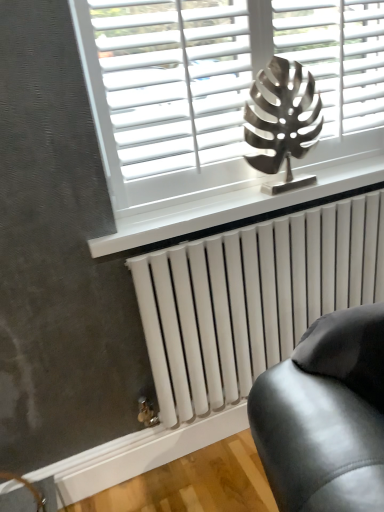
Question: Is white glossy radiator at lower center a part of metallic leaf at center?

Choices:
 (A) no
 (B) yes

Answer: (A)

Question: Is metallic leaf at center shorter than white glossy radiator at lower center?

Choices:
 (A) yes
 (B) no

Answer: (B)

Question: Considering the relative positions of metallic leaf at center and white glossy radiator at lower center in the image provided, is metallic leaf at center behind white glossy radiator at lower center?

Choices:
 (A) yes
 (B) no

Answer: (B)

Question: Is metallic leaf at center facing away from white glossy radiator at lower center?

Choices:
 (A) yes
 (B) no

Answer: (B)

Question: From a real-world perspective, does metallic leaf at center sit lower than white glossy radiator at lower center?

Choices:
 (A) yes
 (B) no

Answer: (B)

Question: Does point (170, 20) appear closer or farther from the camera than point (132, 239)?

Choices:
 (A) closer
 (B) farther

Answer: (A)

Question: Is white matte blinds at upper center bigger or smaller than white glossy radiator at lower center?

Choices:
 (A) big
 (B) small

Answer: (A)

Question: Visually, is white matte blinds at upper center positioned to the left or to the right of white glossy radiator at lower center?

Choices:
 (A) left
 (B) right

Answer: (A)

Question: Is white matte blinds at upper center inside or outside of white glossy radiator at lower center?

Choices:
 (A) outside
 (B) inside

Answer: (A)

Question: From a real-world perspective, is white matte blinds at upper center positioned above or below white metallic radiator at lower center?

Choices:
 (A) below
 (B) above

Answer: (B)

Question: Is white matte blinds at upper center taller or shorter than white metallic radiator at lower center?

Choices:
 (A) short
 (B) tall

Answer: (A)

Question: Is white matte blinds at upper center inside or outside of white metallic radiator at lower center?

Choices:
 (A) outside
 (B) inside

Answer: (A)

Question: In terms of width, does white matte blinds at upper center look wider or thinner when compared to white metallic radiator at lower center?

Choices:
 (A) wide
 (B) thin

Answer: (B)

Question: Looking at the image, does white metallic radiator at lower center seem bigger or smaller compared to white matte blinds at upper center?

Choices:
 (A) small
 (B) big

Answer: (B)

Question: In the image, is white metallic radiator at lower center positioned in front of or behind white matte blinds at upper center?

Choices:
 (A) behind
 (B) front

Answer: (A)